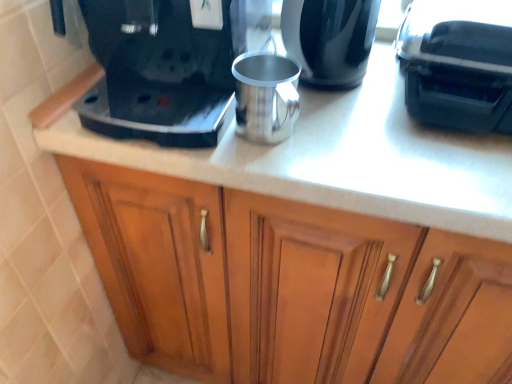
Image resolution: width=512 pixels, height=384 pixels. What do you see at coordinates (266, 96) in the screenshot?
I see `polished metal mug at center` at bounding box center [266, 96].

Find the location of a particular element. This screenshot has height=384, width=512. black plastic coffee maker at upper left is located at coordinates [166, 69].

The height and width of the screenshot is (384, 512). Describe the element at coordinates (290, 285) in the screenshot. I see `wooden cabinet at center` at that location.

Image resolution: width=512 pixels, height=384 pixels. What are the coordinates of `shiny black kettle at upper center` in the screenshot? It's located at (330, 39).

Measure the distance between shiny black kettle at upper center and camera.

shiny black kettle at upper center and camera are 24.70 inches apart.

The image size is (512, 384). I want to click on black plastic coffee machine at upper right, so click(x=458, y=64).

Is black plastic coffee machine at upper right to the left or to the right of black plastic coffee maker at upper left in the image?

From the image, it's evident that black plastic coffee machine at upper right is to the right of black plastic coffee maker at upper left.

From the image's perspective, between black plastic coffee machine at upper right and black plastic coffee maker at upper left, which one is located above?

black plastic coffee maker at upper left.

Does black plastic coffee machine at upper right have a lesser height compared to black plastic coffee maker at upper left?

Yes, black plastic coffee machine at upper right is shorter than black plastic coffee maker at upper left.

Which is in front, shiny black kettle at upper center or black plastic coffee maker at upper left?

black plastic coffee maker at upper left is closer to the camera.

Considering the positions of points (340, 57) and (105, 69), is point (340, 57) farther from camera compared to point (105, 69)?

No, (340, 57) is in front of (105, 69).

From the image's perspective, is shiny black kettle at upper center over black plastic coffee maker at upper left?

No, from the image's perspective, shiny black kettle at upper center is not above black plastic coffee maker at upper left.

Considering the sizes of shiny black kettle at upper center and black plastic coffee maker at upper left in the image, is shiny black kettle at upper center bigger or smaller than black plastic coffee maker at upper left?

In the image, shiny black kettle at upper center appears to be smaller than black plastic coffee maker at upper left.

Is wooden cabinet at center touching black plastic coffee maker at upper left?

No, wooden cabinet at center is not beside black plastic coffee maker at upper left.

From a real-world perspective, between wooden cabinet at center and black plastic coffee maker at upper left, who is vertically lower?

In real-world perspective, wooden cabinet at center is lower.

From the image's perspective, between wooden cabinet at center and black plastic coffee maker at upper left, who is located below?

wooden cabinet at center.

Does point (481, 84) come behind point (364, 3)?

No, (481, 84) is in front of (364, 3).

How many degrees apart are the facing directions of black plastic coffee machine at upper right and shiny black kettle at upper center?

They differ by 5.46 degrees in their facing directions.

Measure the distance between black plastic coffee machine at upper right and shiny black kettle at upper center.

They are 5.93 inches apart.

Is shiny black kettle at upper center at the back of black plastic coffee machine at upper right?

No, shiny black kettle at upper center is not at the back of black plastic coffee machine at upper right.

Consider the image. Is wooden cabinet at center next to polished metal mug at center and touching it?

wooden cabinet at center and polished metal mug at center are clearly separated.

Does point (411, 347) come in front of point (285, 58)?

No, (411, 347) is further to viewer.

Is wooden cabinet at center at the right side of polished metal mug at center?

Indeed, wooden cabinet at center is positioned on the right side of polished metal mug at center.

Does wooden cabinet at center have a greater width compared to polished metal mug at center?

Yes.

Can you confirm if polished metal mug at center is positioned to the right of shiny black kettle at upper center?

In fact, polished metal mug at center is to the left of shiny black kettle at upper center.

From the picture: Is polished metal mug at center positioned with its back to shiny black kettle at upper center?

Correct, polished metal mug at center is looking away from shiny black kettle at upper center.

Would you say polished metal mug at center contains shiny black kettle at upper center?

No, shiny black kettle at upper center is not a part of polished metal mug at center.

From the image's perspective, between black plastic coffee machine at upper right and polished metal mug at center, who is located below?

polished metal mug at center is shown below in the image.

Is point (426, 69) closer to viewer compared to point (260, 110)?

No, it is not.

Would you say black plastic coffee machine at upper right is outside polished metal mug at center?

Yes, black plastic coffee machine at upper right is not within polished metal mug at center.

Considering the sizes of black plastic coffee machine at upper right and polished metal mug at center in the image, is black plastic coffee machine at upper right taller or shorter than polished metal mug at center?

Considering their sizes, black plastic coffee machine at upper right has more height than polished metal mug at center.

Where is `coffee machine below the black plastic coffee maker at upper left (from the image's perspective)`? This screenshot has height=384, width=512. coffee machine below the black plastic coffee maker at upper left (from the image's perspective) is located at coordinates (458, 64).

Image resolution: width=512 pixels, height=384 pixels. What are the coordinates of `home appliance above the shiny black kettle at upper center (from a real-world perspective)` in the screenshot? It's located at (166, 69).

Looking at the image, which one is located closer to wooden cabinet at center, polished metal mug at center or black plastic coffee maker at upper left?

black plastic coffee maker at upper left is closer to wooden cabinet at center.

When comparing their distances from black plastic coffee maker at upper left, does shiny black kettle at upper center or black plastic coffee machine at upper right seem closer?

shiny black kettle at upper center is closer to black plastic coffee maker at upper left.

Estimate the real-world distances between objects in this image. Which object is further from shiny black kettle at upper center, black plastic coffee maker at upper left or wooden cabinet at center?

Based on the image, wooden cabinet at center appears to be further to shiny black kettle at upper center.

Based on their spatial positions, is black plastic coffee machine at upper right or black plastic coffee maker at upper left closer to polished metal mug at center?

The object closer to polished metal mug at center is black plastic coffee maker at upper left.

From the image, which object appears to be farther from black plastic coffee machine at upper right, wooden cabinet at center or shiny black kettle at upper center?

wooden cabinet at center is further to black plastic coffee machine at upper right.

Which object lies nearer to the anchor point polished metal mug at center, black plastic coffee maker at upper left or shiny black kettle at upper center?

shiny black kettle at upper center is closer to polished metal mug at center.

Looking at the image, which one is located further to black plastic coffee machine at upper right, polished metal mug at center or black plastic coffee maker at upper left?

black plastic coffee maker at upper left.

From the image, which object appears to be farther from black plastic coffee maker at upper left, polished metal mug at center or black plastic coffee machine at upper right?

Among the two, black plastic coffee machine at upper right is located further to black plastic coffee maker at upper left.

Image resolution: width=512 pixels, height=384 pixels. I want to click on cabinetry between black plastic coffee maker at upper left and black plastic coffee machine at upper right, so click(x=290, y=285).

You are a GUI agent. You are given a task and a screenshot of the screen. Output one action in this format:
    pyautogui.click(x=<x>, y=<y>)
    Task: Click on the mug between black plastic coffee maker at upper left and wooden cabinet at center in the vertical direction
    
    Given the screenshot: What is the action you would take?
    pyautogui.click(x=266, y=96)

Locate an element on the screen. kitchen appliance between black plastic coffee maker at upper left and black plastic coffee machine at upper right from left to right is located at coordinates (330, 39).

At what (x,y) coordinates should I click in order to perform the action: click on mug between black plastic coffee maker at upper left and black plastic coffee machine at upper right in the horizontal direction. Please return your answer as a coordinate pair (x, y). Looking at the image, I should click on (266, 96).